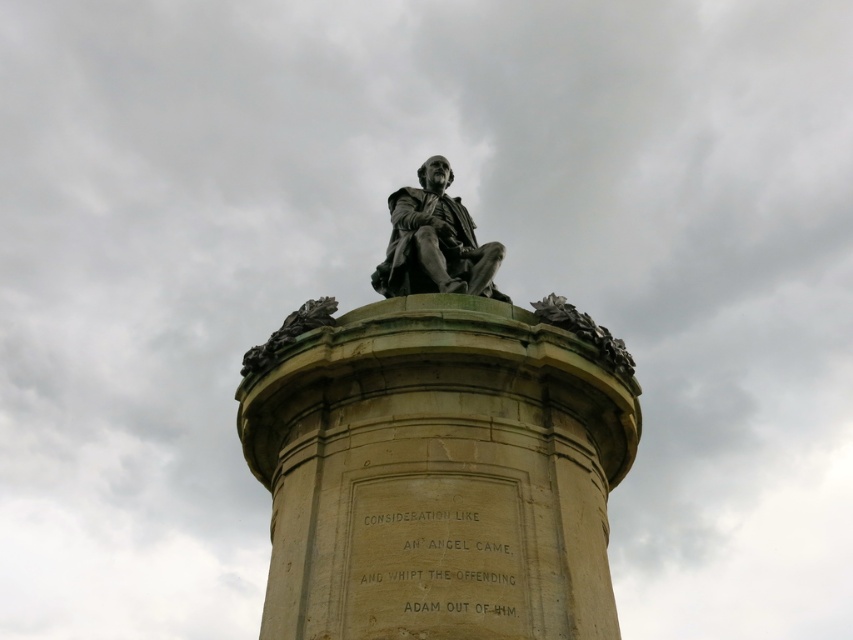
Question: Which object is closer to the camera taking this photo?

Choices:
 (A) bronze statue at center
 (B) stone column at center

Answer: (B)

Question: Which point is closer to the camera?

Choices:
 (A) stone column at center
 (B) bronze statue at center

Answer: (A)

Question: Is stone column at center bigger than bronze statue at center?

Choices:
 (A) yes
 (B) no

Answer: (A)

Question: Can you confirm if stone column at center is positioned to the left of bronze statue at center?

Choices:
 (A) yes
 (B) no

Answer: (B)

Question: Is stone column at center wider than bronze statue at center?

Choices:
 (A) yes
 (B) no

Answer: (A)